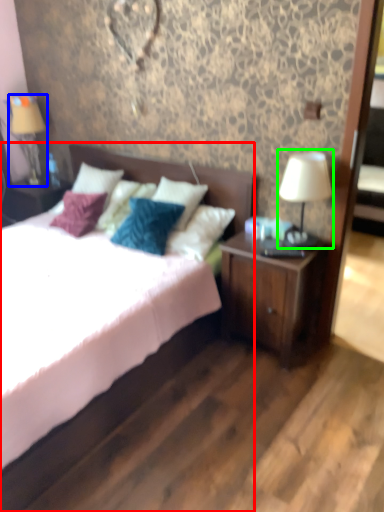
Question: Based on their relative distances, which object is nearer to bed (highlighted by a red box)? Choose from table lamp (highlighted by a blue box) and table lamp (highlighted by a green box).

Choices:
 (A) table lamp
 (B) table lamp

Answer: (B)